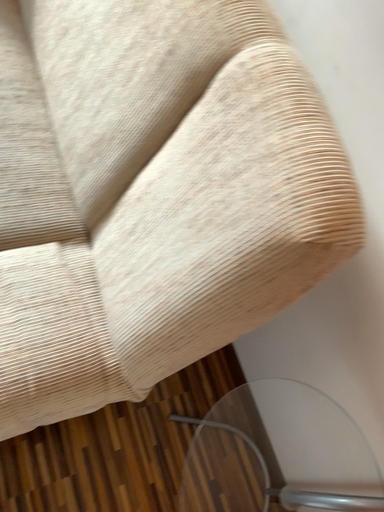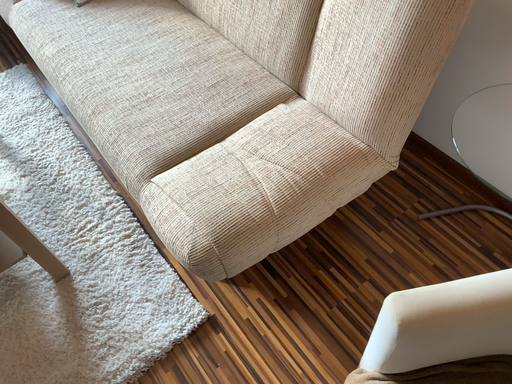
Question: Which way did the camera rotate in the video?

Choices:
 (A) rotated left
 (B) rotated right

Answer: (A)